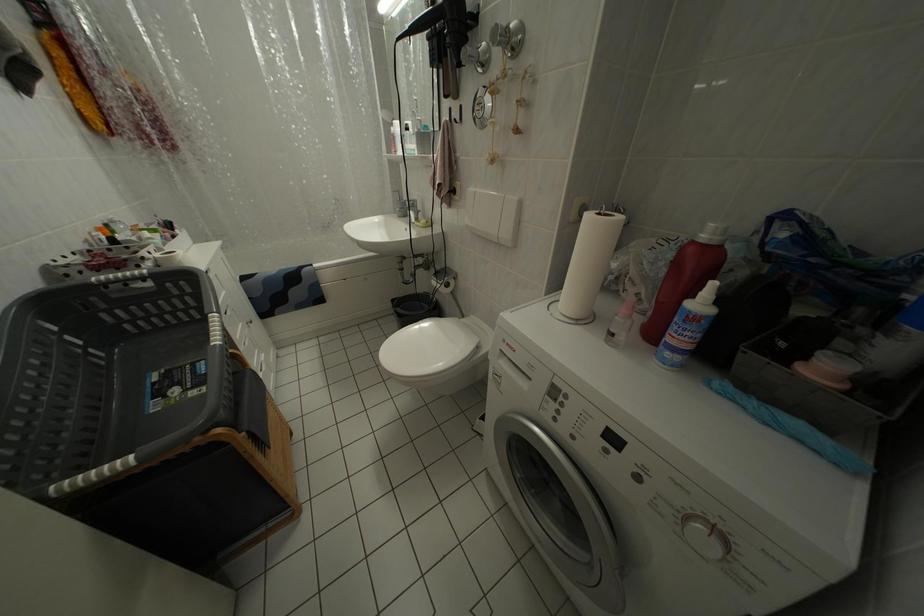
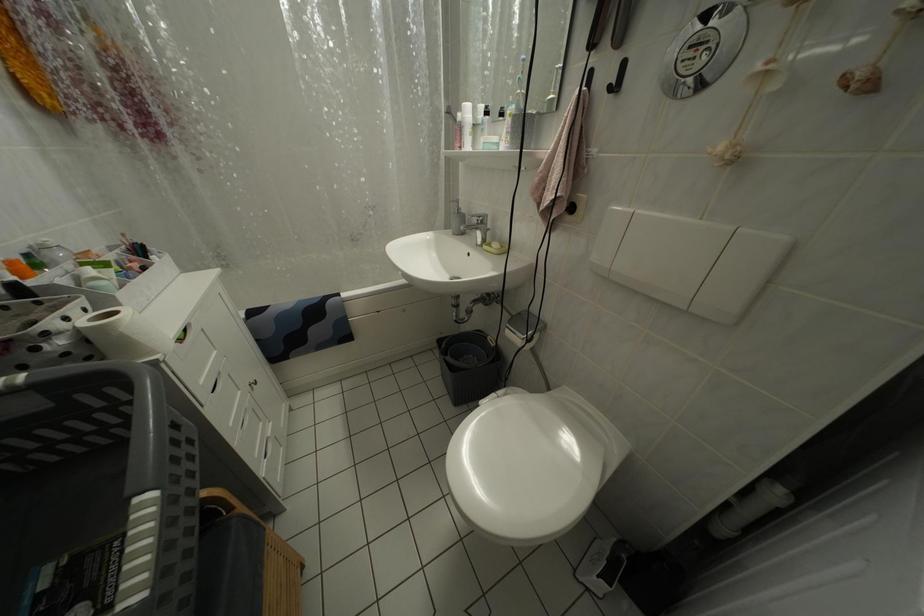
Question: The camera is either moving clockwise (left) or counter-clockwise (right) around the object. The first image is from the beginning of the video and the second image is from the end. Is the camera moving left or right when shooting the video?

Choices:
 (A) Left
 (B) Right

Answer: (B)